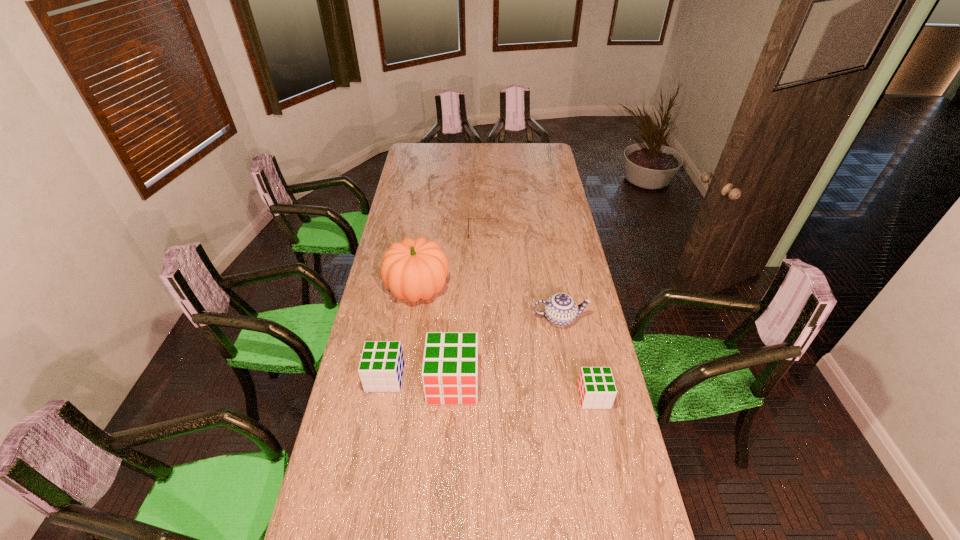
I want to click on free space located on the red face of the rightmost cube, so coord(523,396).

Where is `vacant position located on the red face of the rightmost cube`? vacant position located on the red face of the rightmost cube is located at coordinates (553, 396).

Locate an element on the screen. vacant space located 0.200m on the red face of the rightmost cube is located at coordinates (520, 396).

Identify the location of vacant region located 0.350m on the front-facing side of the shortest object. (397, 232).

Image resolution: width=960 pixels, height=540 pixels. What are the coordinates of `free region located 0.290m on the front-facing side of the shortest object` in the screenshot? It's located at (410, 232).

I want to click on vacant area situated on the front-facing side of the shortest object, so click(452, 232).

This screenshot has width=960, height=540. I want to click on vacant area located 0.310m on the back of the tallest object, so click(x=427, y=227).

You are a GUI agent. You are given a task and a screenshot of the screen. Output one action in this format:
    pyautogui.click(x=<x>, y=<y>)
    Task: Click on the cube at the left edge
    The width and height of the screenshot is (960, 540).
    Given the screenshot: What is the action you would take?
    pyautogui.click(x=381, y=366)

Identify the location of pumpkin that is at the left edge. (413, 269).

Where is `cube that is at the right edge`? The image size is (960, 540). cube that is at the right edge is located at coordinates (596, 386).